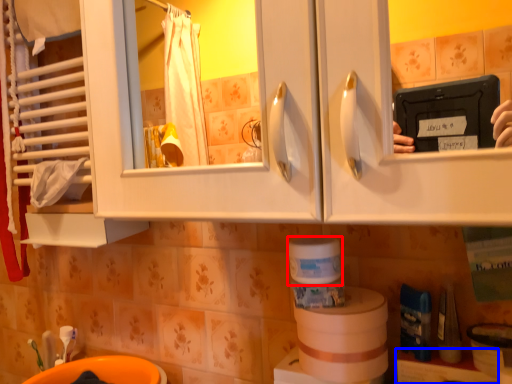
Question: Which point is further to the camera, toilet paper (highlighted by a red box) or shelf (highlighted by a blue box)?

Choices:
 (A) toilet paper
 (B) shelf

Answer: (A)